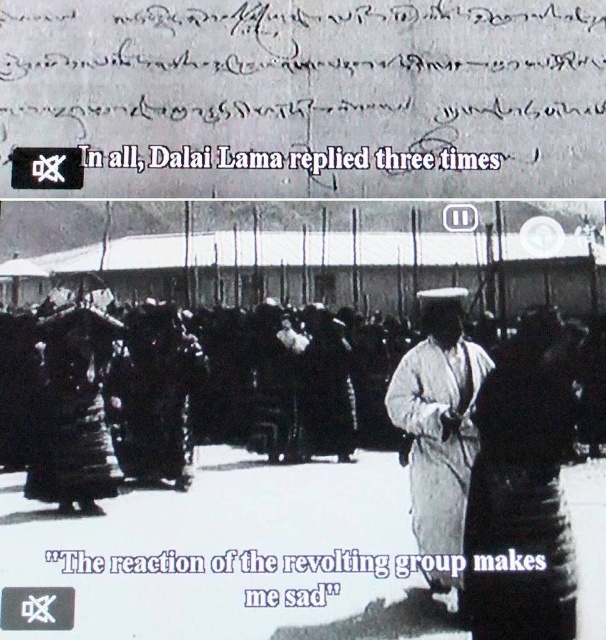
Question: Which point appears farthest from the camera in this image?

Choices:
 (A) (465, 371)
 (B) (376, 557)

Answer: (A)

Question: From the image, what is the correct spatial relationship of dark fabric dress at center in relation to white cotton robe at center?

Choices:
 (A) right
 (B) left

Answer: (A)

Question: Does dark fabric dress at center appear over black paper text at center?

Choices:
 (A) no
 (B) yes

Answer: (B)

Question: From the image, what is the correct spatial relationship of dark fabric dress at center in relation to white cotton robe at center?

Choices:
 (A) below
 (B) above

Answer: (A)

Question: Which object appears farthest from the camera in this image?

Choices:
 (A) dark fabric dress at center
 (B) white cotton robe at center

Answer: (B)

Question: Estimate the real-world distances between objects in this image. Which object is closer to the black paper text at center?

Choices:
 (A) white cotton robe at center
 (B) dark fabric dress at center

Answer: (B)